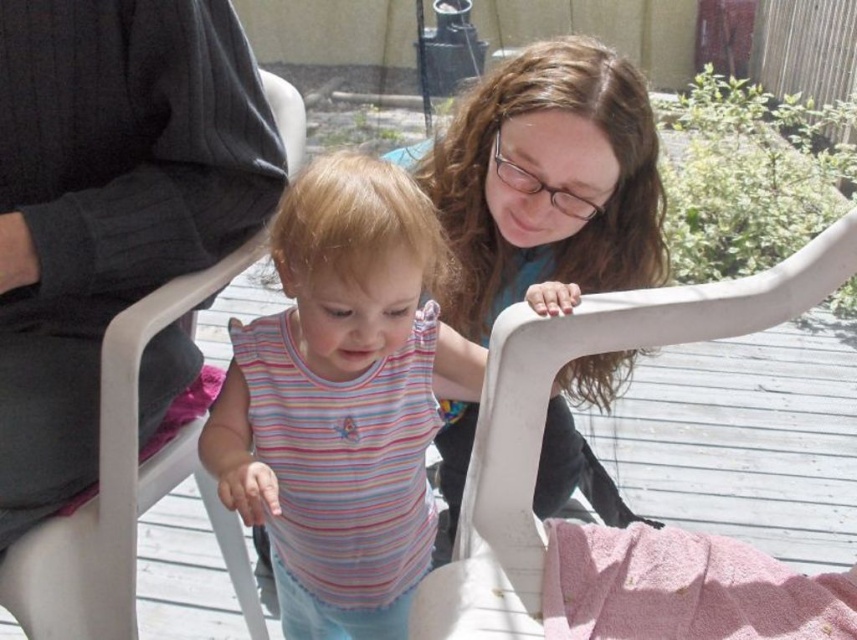
Question: Can you confirm if striped fabric at center is thinner than white plastic folding chair at upper center?

Choices:
 (A) no
 (B) yes

Answer: (B)

Question: Which object is farther from the camera taking this photo?

Choices:
 (A) striped fabric at center
 (B) white plastic folding chair at upper center
 (C) white plastic chair at left
 (D) matte black shirt at upper center

Answer: (D)

Question: Is white plastic folding chair at upper center positioned at the back of white plastic chair at left?

Choices:
 (A) yes
 (B) no

Answer: (B)

Question: Which of these objects is positioned farthest from the white plastic chair at left?

Choices:
 (A) matte black shirt at upper center
 (B) striped fabric at center
 (C) white plastic folding chair at upper center

Answer: (A)

Question: Is striped fabric at center to the right of matte black shirt at upper center from the viewer's perspective?

Choices:
 (A) no
 (B) yes

Answer: (A)

Question: Among these objects, which one is nearest to the camera?

Choices:
 (A) white plastic chair at left
 (B) white plastic folding chair at upper center
 (C) matte black shirt at upper center
 (D) striped fabric at center

Answer: (B)